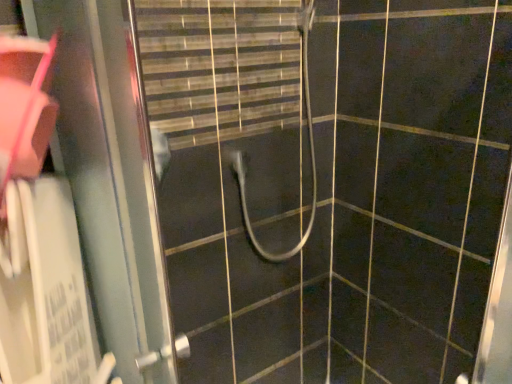
This screenshot has height=384, width=512. Identify the location of metallic sliding door at left. (110, 179).

Image resolution: width=512 pixels, height=384 pixels. What do you see at coordinates (110, 179) in the screenshot? I see `metallic sliding door at left` at bounding box center [110, 179].

What do you see at coordinates (309, 149) in the screenshot? I see `white rubber hose at center` at bounding box center [309, 149].

Measure the distance between white rubber hose at center and camera.

They are 4.04 feet apart.

You are a GUI agent. You are given a task and a screenshot of the screen. Output one action in this format:
    pyautogui.click(x=<x>, y=<y>)
    Task: Click on the white rubber hose at center
    
    Given the screenshot: What is the action you would take?
    pyautogui.click(x=309, y=149)

At what (x,y) coordinates should I click in order to perform the action: click on metallic sliding door at left. Please return your answer as a coordinate pair (x, y). The width and height of the screenshot is (512, 384). Looking at the image, I should click on (110, 179).

Is white rubber hose at center at the left side of metallic sliding door at left?

In fact, white rubber hose at center is to the right of metallic sliding door at left.

Which object is closer to the camera, white rubber hose at center or metallic sliding door at left?

metallic sliding door at left is more forward.

Considering the points (241, 156) and (140, 213), which point is behind, point (241, 156) or point (140, 213)?

Positioned behind is point (241, 156).

From the image's perspective, relative to metallic sliding door at left, is white rubber hose at center above or below?

white rubber hose at center is situated higher than metallic sliding door at left in the image.

From a real-world perspective, which object stands above the other?

white rubber hose at center is physically above.

Looking at this image, considering the sizes of objects white rubber hose at center and metallic sliding door at left in the image provided, who is wider, white rubber hose at center or metallic sliding door at left?

white rubber hose at center.

From their relative heights in the image, would you say white rubber hose at center is taller or shorter than metallic sliding door at left?

Clearly, white rubber hose at center is shorter compared to metallic sliding door at left.

Is white rubber hose at center bigger than metallic sliding door at left?

Yes.

Is white rubber hose at center inside or outside of metallic sliding door at left?

white rubber hose at center is outside metallic sliding door at left.

Does white rubber hose at center touch metallic sliding door at left?

No, white rubber hose at center is not touching metallic sliding door at left.

Based on the photo, is white rubber hose at center oriented away from metallic sliding door at left?

Answer: That's not correct — white rubber hose at center is not looking away from metallic sliding door at left.

What's the angular difference between white rubber hose at center and metallic sliding door at left's facing directions?

There is a 90.5-degree angle between the facing directions of white rubber hose at center and metallic sliding door at left.

You are a GUI agent. You are given a task and a screenshot of the screen. Output one action in this format:
    pyautogui.click(x=<x>, y=<y>)
    Task: Click on the shower above the metallic sliding door at left (from a real-world perspective)
    The height and width of the screenshot is (384, 512).
    Given the screenshot: What is the action you would take?
    pyautogui.click(x=309, y=149)

Which is more to the left, metallic sliding door at left or white rubber hose at center?

From the viewer's perspective, metallic sliding door at left appears more on the left side.

Which object is more forward, metallic sliding door at left or white rubber hose at center?

Positioned in front is metallic sliding door at left.

Which is less distant, (130,101) or (246,200)?

Point (130,101) appears to be closer to the viewer than point (246,200).

From the image's perspective, is metallic sliding door at left above or below white rubber hose at center?

From the image's perspective, metallic sliding door at left appears below white rubber hose at center.

From a real-world perspective, who is located lower, metallic sliding door at left or white rubber hose at center?

metallic sliding door at left is physically lower.

Which of these two, metallic sliding door at left or white rubber hose at center, is wider?

Wider between the two is white rubber hose at center.

Considering the relative sizes of metallic sliding door at left and white rubber hose at center in the image provided, is metallic sliding door at left shorter than white rubber hose at center?

No.

Is metallic sliding door at left smaller than white rubber hose at center?

Yes.

Is metallic sliding door at left situated inside white rubber hose at center or outside?

metallic sliding door at left is spatially situated outside white rubber hose at center.

Is metallic sliding door at left next to white rubber hose at center and touching it?

metallic sliding door at left and white rubber hose at center are clearly separated.

Could you tell me if metallic sliding door at left is turned towards white rubber hose at center?

No, metallic sliding door at left does not turn towards white rubber hose at center.

Can you tell me how much metallic sliding door at left and white rubber hose at center differ in facing direction?

There is a 90.5-degree angle between the facing directions of metallic sliding door at left and white rubber hose at center.

Locate an element on the screen. screen door that appears in front of the white rubber hose at center is located at coordinates (110, 179).

In the image, there is a white rubber hose at center. At what (x,y) coordinates should I click in order to perform the action: click on screen door below it (from a real-world perspective). Please return your answer as a coordinate pair (x, y). Image resolution: width=512 pixels, height=384 pixels. Looking at the image, I should click on (110, 179).

Find the location of a particular element. screen door lying below the white rubber hose at center (from the image's perspective) is located at coordinates (110, 179).